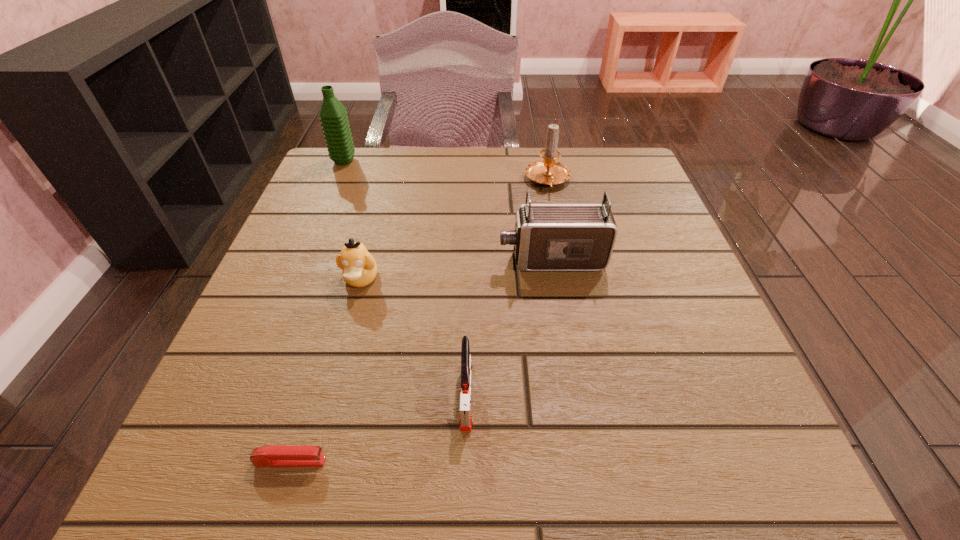
This screenshot has width=960, height=540. What are the coordinates of `stapler at the left edge` in the screenshot? It's located at (272, 455).

Where is `object situated at the right edge`? The width and height of the screenshot is (960, 540). object situated at the right edge is located at coordinates (547, 237).

You are a GUI agent. You are given a task and a screenshot of the screen. Output one action in this format:
    pyautogui.click(x=<x>, y=<y>)
    Task: Click on the object positioned at the far left corner
    The width and height of the screenshot is (960, 540).
    Given the screenshot: What is the action you would take?
    pyautogui.click(x=333, y=116)

The width and height of the screenshot is (960, 540). I want to click on object positioned at the near left corner, so click(x=272, y=455).

Identify the location of free space at the far edge of the desktop. (461, 177).

In the image, there is a desktop. Where is `vacant area at the near edge`? This screenshot has width=960, height=540. vacant area at the near edge is located at coordinates (636, 447).

In the image, there is a desktop. Identify the location of free space at the left edge. point(283,266).

The height and width of the screenshot is (540, 960). I want to click on free space at the right edge of the desktop, so (661, 422).

Identify the location of vacant space at the far left corner of the desktop. (320, 178).

Identify the location of free space at the near left corner of the desktop. This screenshot has width=960, height=540. (199, 492).